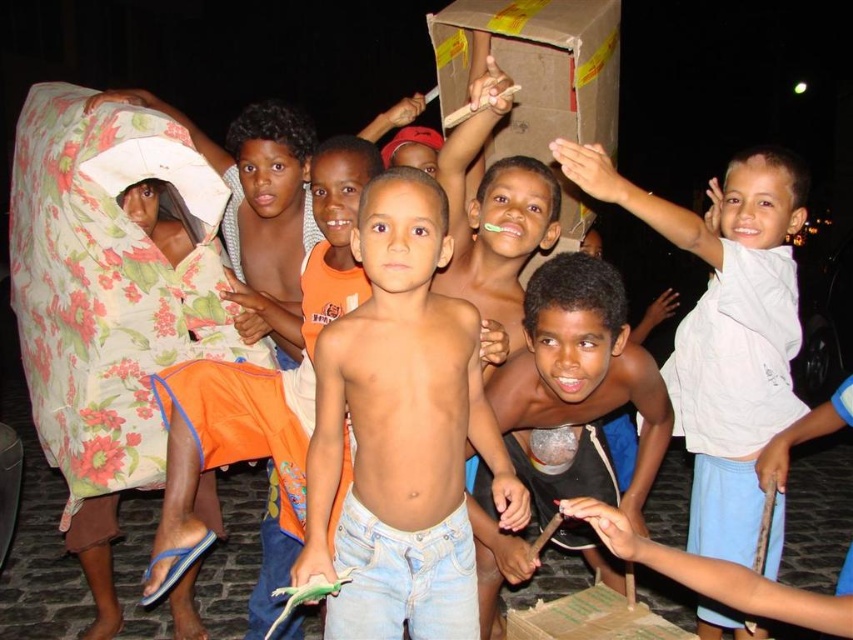
You are a photographer trying to capture a candid shot of the light blue denim jeans at center and the shiny metallic cup at center. Since you want to focus on the jeans, should you adjust your camera to focus on the object that is closer to you?

Yes, you should focus on the light blue denim jeans at center because it is in front of the shiny metallic cup at center, making it closer to you.